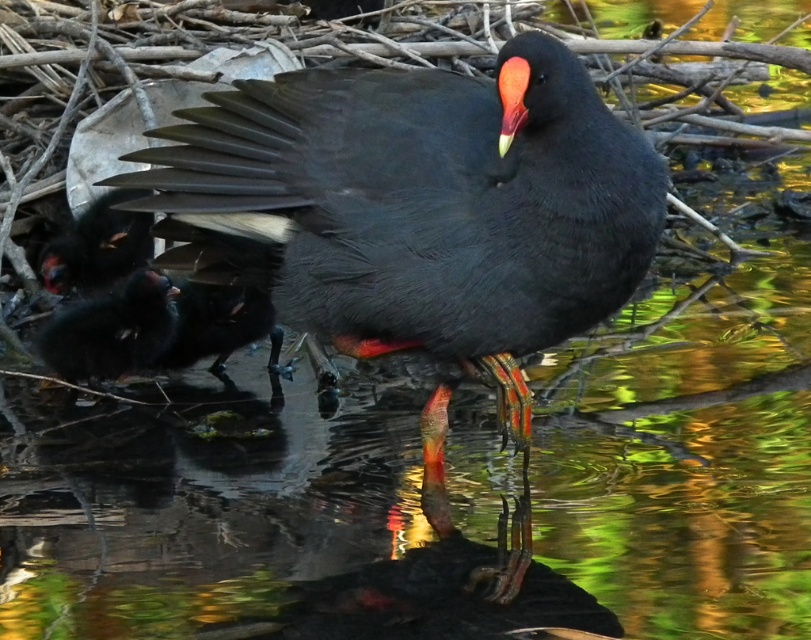
This screenshot has width=811, height=640. What do you see at coordinates (419, 216) in the screenshot?
I see `matte black bird at center` at bounding box center [419, 216].

From the picture: Can you confirm if matte black bird at center is taller than matte black bird at lower left?

Indeed, matte black bird at center has a greater height compared to matte black bird at lower left.

Where is `matte black bird at center`? The height and width of the screenshot is (640, 811). matte black bird at center is located at coordinates (419, 216).